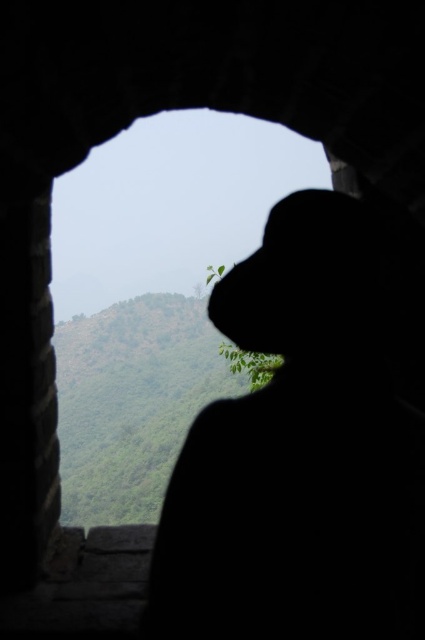
Does silhouette hat at center appear over transparent glass window at center?

Actually, silhouette hat at center is below transparent glass window at center.

Is silhouette hat at center wider than transparent glass window at center?

Incorrect, silhouette hat at center's width does not surpass transparent glass window at center's.

At what (x,y) coordinates should I click in order to perform the action: click on silhouette hat at center. Please return your answer as a coordinate pair (x, y). This screenshot has height=640, width=425. Looking at the image, I should click on (297, 451).